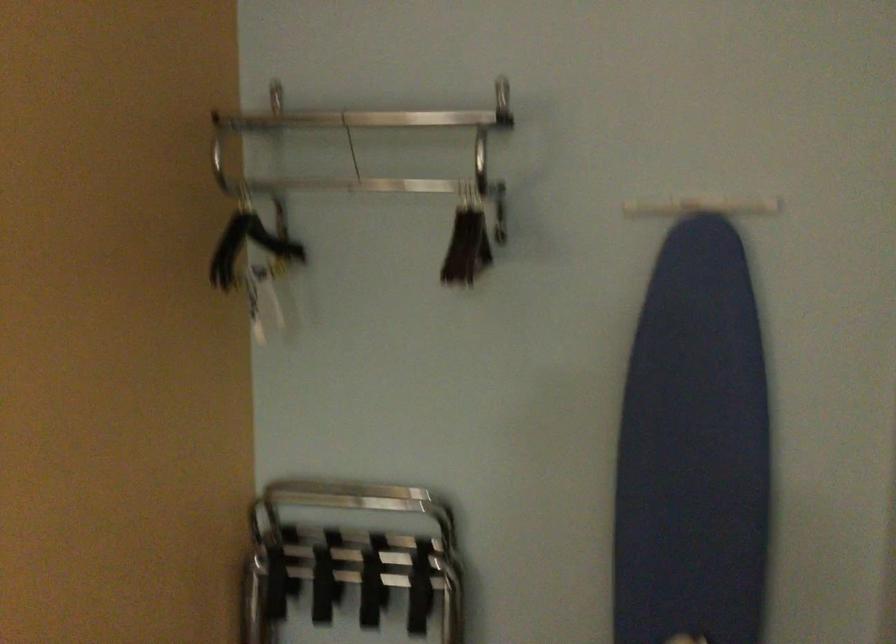
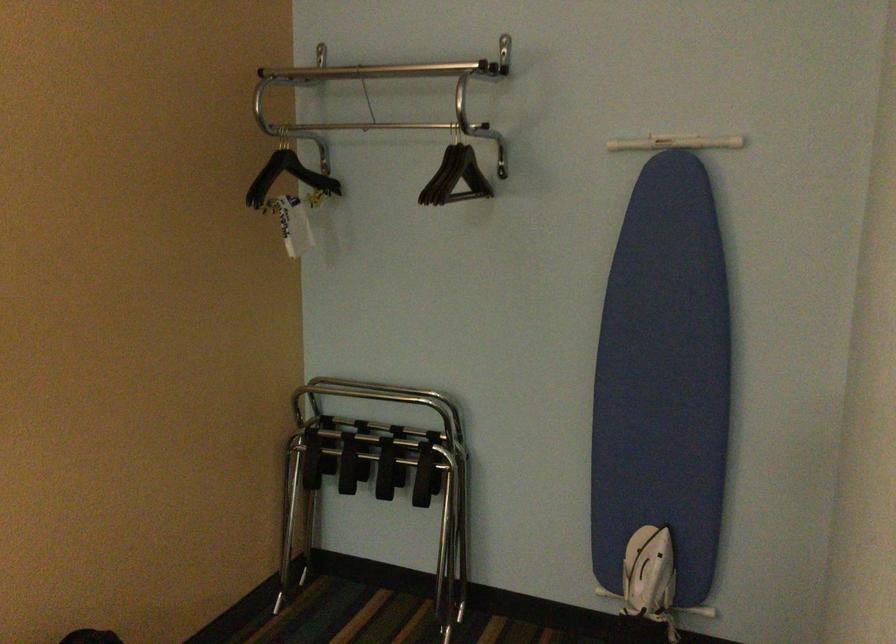
Where in the second image is the point corresponding to point (698, 467) from the first image?

(662, 379)